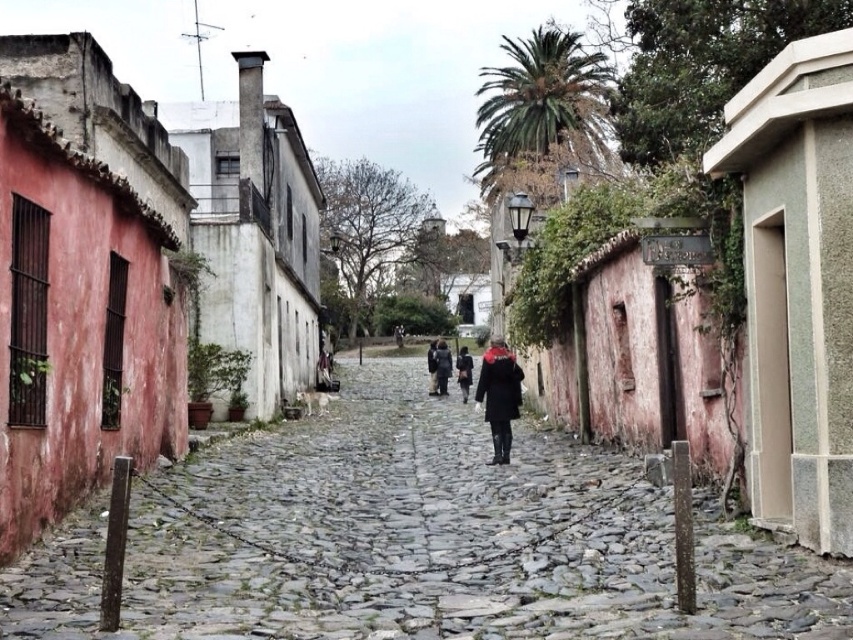
You are a passerby on the cobblestone street and see both the dark gray fabric coat at center and the dark brown leather jacket at center. Which one is located to the right side?

The dark gray fabric coat at center is positioned on the right side of the dark brown leather jacket at center.